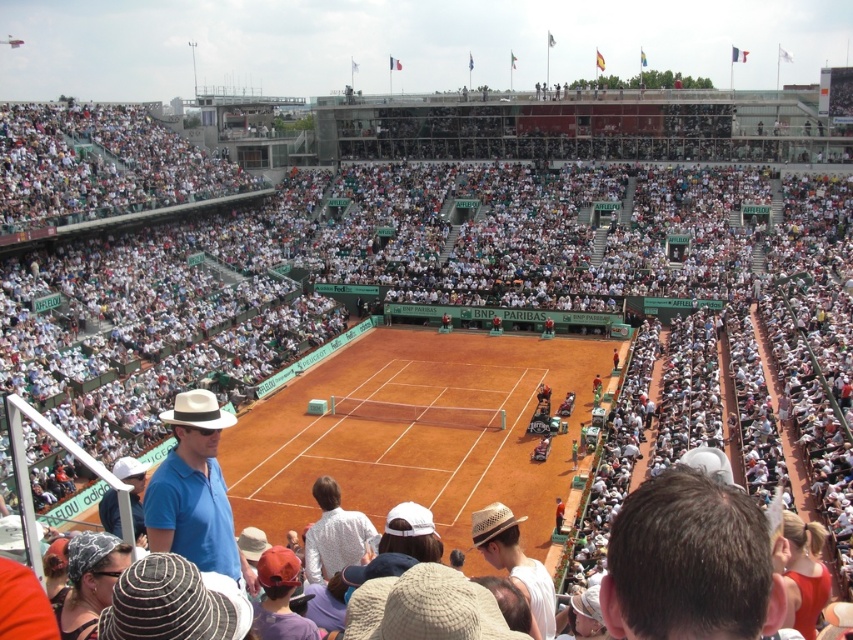
Question: Which point appears farthest from the camera in this image?

Choices:
 (A) (128, 461)
 (B) (686, 516)

Answer: (A)

Question: Does brown hair at upper center have a larger size compared to white straw hat at lower center?

Choices:
 (A) no
 (B) yes

Answer: (A)

Question: Does brown hair at upper center have a greater width compared to white straw hat at lower center?

Choices:
 (A) no
 (B) yes

Answer: (A)

Question: In this image, where is matte blue shirt at lower left located relative to white textured shirt at center?

Choices:
 (A) below
 (B) above

Answer: (B)

Question: Which object appears farthest from the camera in this image?

Choices:
 (A) white straw hat at lower center
 (B) brown hair at upper center
 (C) white textured shirt at center

Answer: (C)

Question: Which of the following is the farthest from the observer?

Choices:
 (A) matte blue shirt at lower left
 (B) white textured shirt at center

Answer: (B)